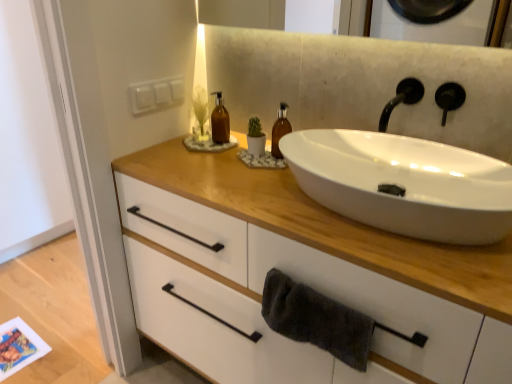
Question: Does brown glass bottle at center, acting as the second bottle starting from the right, turn towards dark gray towel at lower center?

Choices:
 (A) yes
 (B) no

Answer: (B)

Question: Is brown glass bottle at center, the first bottle viewed from the left, completely or partially outside of dark gray towel at lower center?

Choices:
 (A) no
 (B) yes

Answer: (B)

Question: From the image's perspective, is brown glass bottle at center, the first bottle viewed from the left, located above dark gray towel at lower center?

Choices:
 (A) yes
 (B) no

Answer: (A)

Question: Considering the relative sizes of brown glass bottle at center, acting as the second bottle starting from the right, and dark gray towel at lower center in the image provided, is brown glass bottle at center, acting as the second bottle starting from the right, shorter than dark gray towel at lower center?

Choices:
 (A) no
 (B) yes

Answer: (A)

Question: Can you confirm if brown glass bottle at center, acting as the second bottle starting from the right, is wider than dark gray towel at lower center?

Choices:
 (A) yes
 (B) no

Answer: (A)

Question: Considering the relative positions of brown glass bottle at center, the first bottle viewed from the left, and dark gray towel at lower center in the image provided, is brown glass bottle at center, the first bottle viewed from the left, to the left of dark gray towel at lower center from the viewer's perspective?

Choices:
 (A) yes
 (B) no

Answer: (A)

Question: Can you confirm if translucent amber bottle at center, which is the second bottle in left-to-right order, is wider than white ceramic sink at center?

Choices:
 (A) no
 (B) yes

Answer: (A)

Question: Considering the relative sizes of translucent amber bottle at center, which is the second bottle in left-to-right order, and white ceramic sink at center in the image provided, is translucent amber bottle at center, which is the second bottle in left-to-right order, taller than white ceramic sink at center?

Choices:
 (A) yes
 (B) no

Answer: (A)

Question: Considering the relative sizes of translucent amber bottle at center, the first bottle when ordered from right to left, and white ceramic sink at center in the image provided, is translucent amber bottle at center, the first bottle when ordered from right to left, thinner than white ceramic sink at center?

Choices:
 (A) yes
 (B) no

Answer: (A)

Question: Could white ceramic sink at center be considered to be inside translucent amber bottle at center, the first bottle when ordered from right to left?

Choices:
 (A) yes
 (B) no

Answer: (B)

Question: Is translucent amber bottle at center, which is the second bottle in left-to-right order, shorter than white ceramic sink at center?

Choices:
 (A) yes
 (B) no

Answer: (B)

Question: Are translucent amber bottle at center, which is the second bottle in left-to-right order, and white ceramic sink at center making contact?

Choices:
 (A) no
 (B) yes

Answer: (A)

Question: Does white matte cabinet at center appear on the right side of black matte tap at upper right?

Choices:
 (A) yes
 (B) no

Answer: (B)